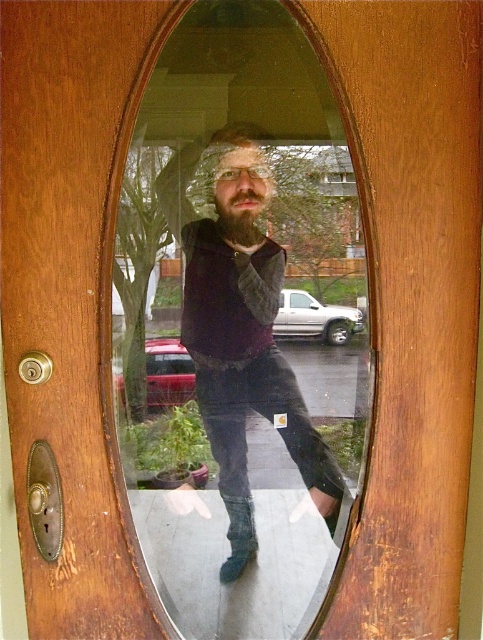
You are standing in front of the wooden door and looking at the arched mirror. There are two points marked on the mirror at coordinates point (257, 397) and point (230, 448). Which point is closer to you?

Point (257, 397) is closer to the camera than point (230, 448).